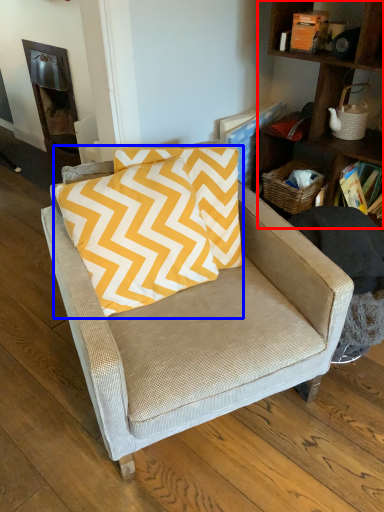
Question: Which of the following is the closest to the observer, shelf (highlighted by a red box) or pillow (highlighted by a blue box)?

Choices:
 (A) shelf
 (B) pillow

Answer: (B)